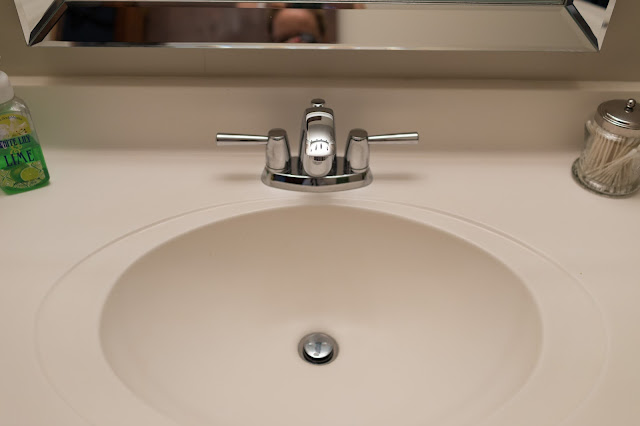
Where is `soap`? Image resolution: width=640 pixels, height=426 pixels. soap is located at coordinates (12, 123).